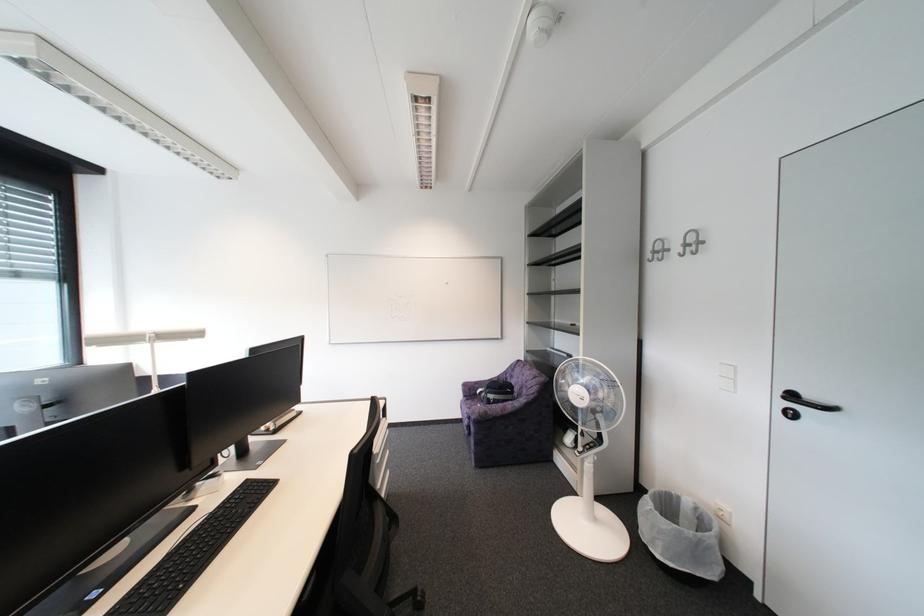
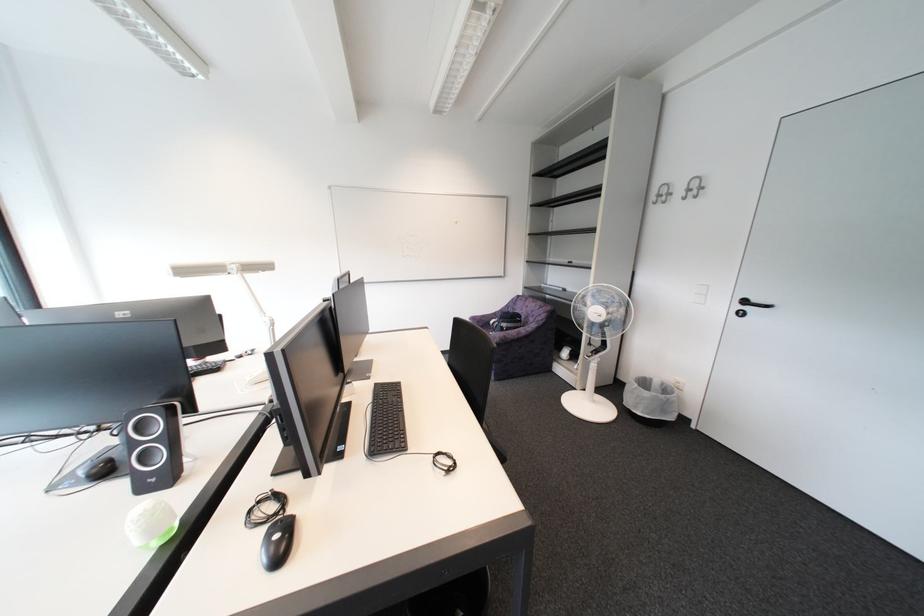
Question: What movement of the cameraman would produce the second image?

Choices:
 (A) Left
 (B) Right
 (C) Forward
 (D) Backward

Answer: (A)